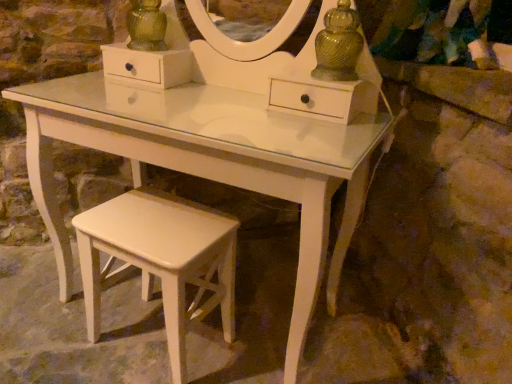
The height and width of the screenshot is (384, 512). I want to click on vacant space to the right of white painted wood stool at lower left, so click(x=257, y=338).